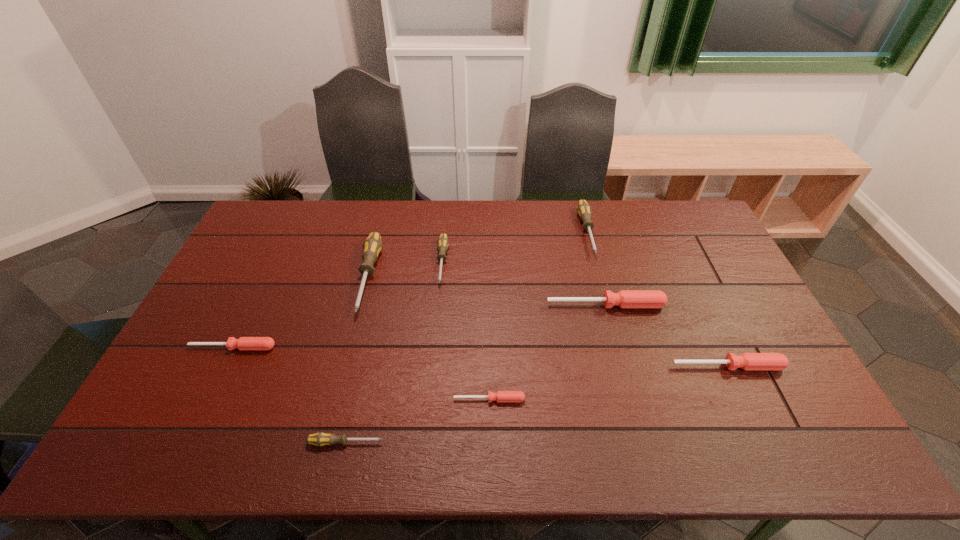
The image size is (960, 540). In order to click on the tallest screwdriver in this screenshot , I will do `click(372, 246)`.

You are a GUI agent. You are given a task and a screenshot of the screen. Output one action in this format:
    pyautogui.click(x=<x>, y=<y>)
    Task: Click on the tallest object
    
    Given the screenshot: What is the action you would take?
    pyautogui.click(x=372, y=246)

Where is `the rightmost gray screwdriver`? This screenshot has width=960, height=540. the rightmost gray screwdriver is located at coordinates (583, 208).

Where is `the farthest red screwdriver`? Image resolution: width=960 pixels, height=540 pixels. the farthest red screwdriver is located at coordinates (626, 299).

This screenshot has height=540, width=960. What are the coordinates of `the second gray screwdriver from right to left` in the screenshot? It's located at (442, 242).

At what (x,y) coordinates should I click in order to perform the action: click on the fifth object from right to left. Please return your answer as a coordinate pair (x, y). The width and height of the screenshot is (960, 540). Looking at the image, I should click on (442, 242).

This screenshot has height=540, width=960. Identify the location of the third nearest object. (747, 361).

Locate an element on the screen. Image resolution: width=960 pixels, height=540 pixels. the third farthest red screwdriver is located at coordinates (747, 361).

In order to click on the fifth farthest object in this screenshot , I will do `click(243, 343)`.

Image resolution: width=960 pixels, height=540 pixels. I want to click on the leftmost red screwdriver, so click(243, 343).